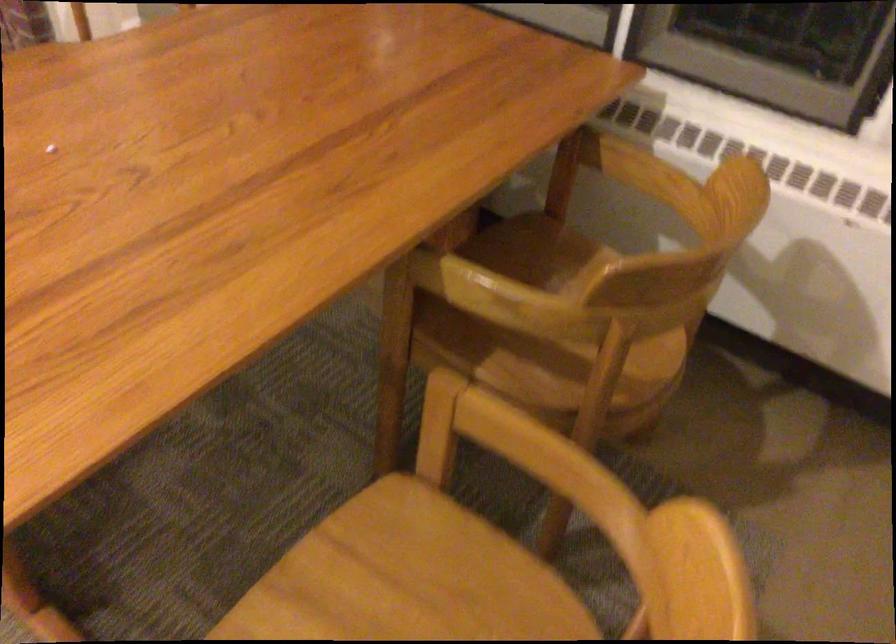
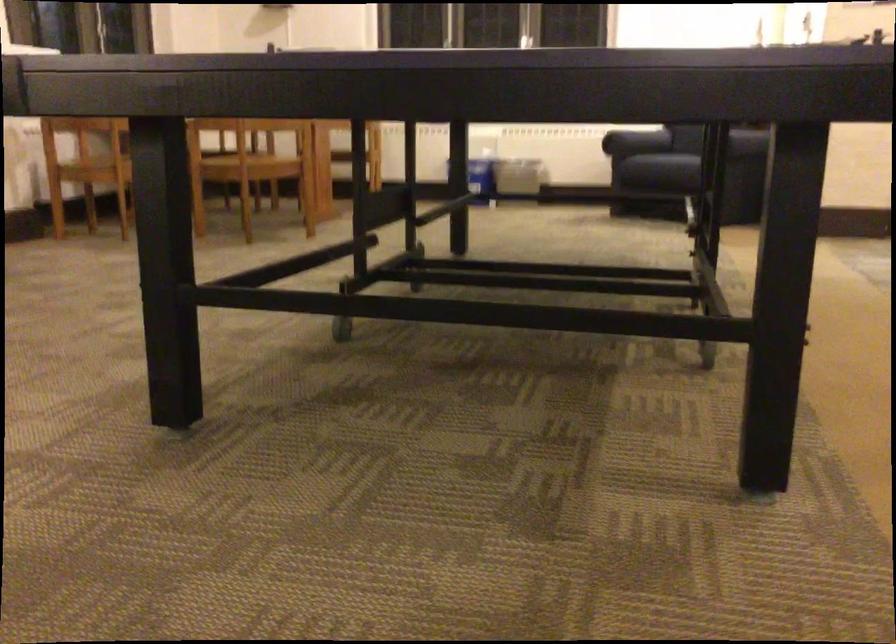
Question: I am providing you with two images of the same scene from different viewpoints. Which of the following objects are not visible in image2?

Choices:
 (A) wooden chair armrest
 (B) sofa sitting surface
 (C) sofa armrest
 (D) black wall eraser

Answer: (A)